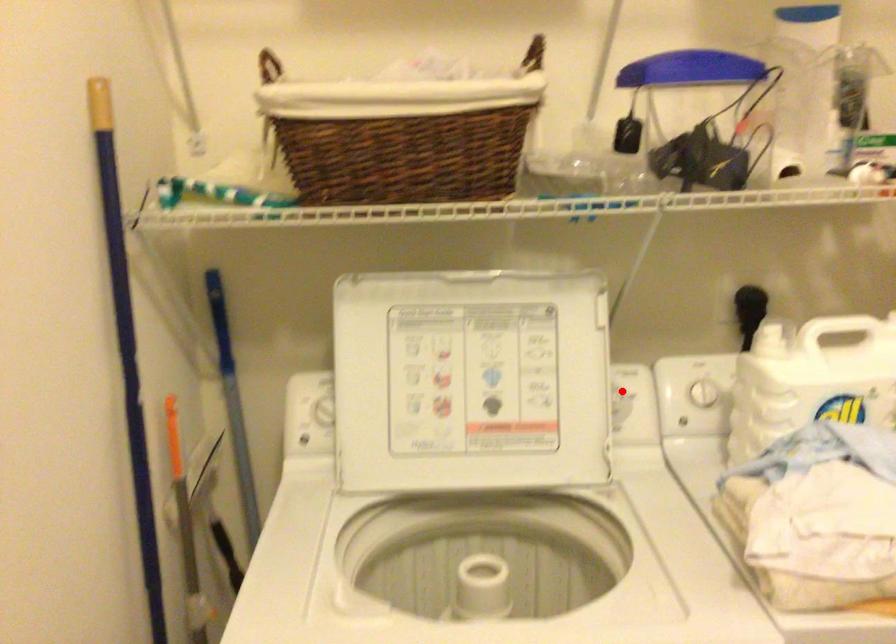
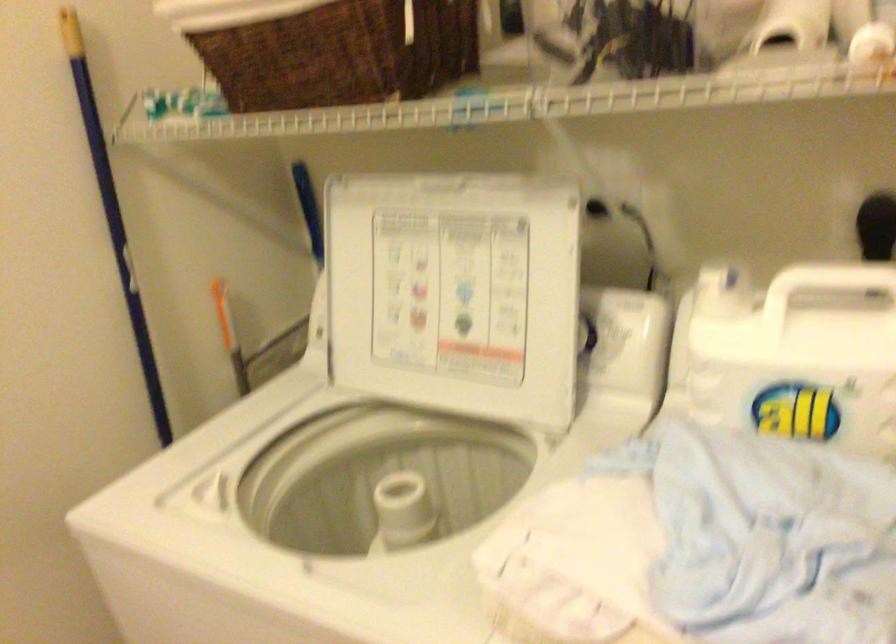
Question: I am providing you with two images of the same scene from different viewpoints. A red point is shown in image1. For the corresponding object point in image2, is it positioned nearer or farther from the camera?

Choices:
 (A) Nearer
 (B) Farther

Answer: (A)